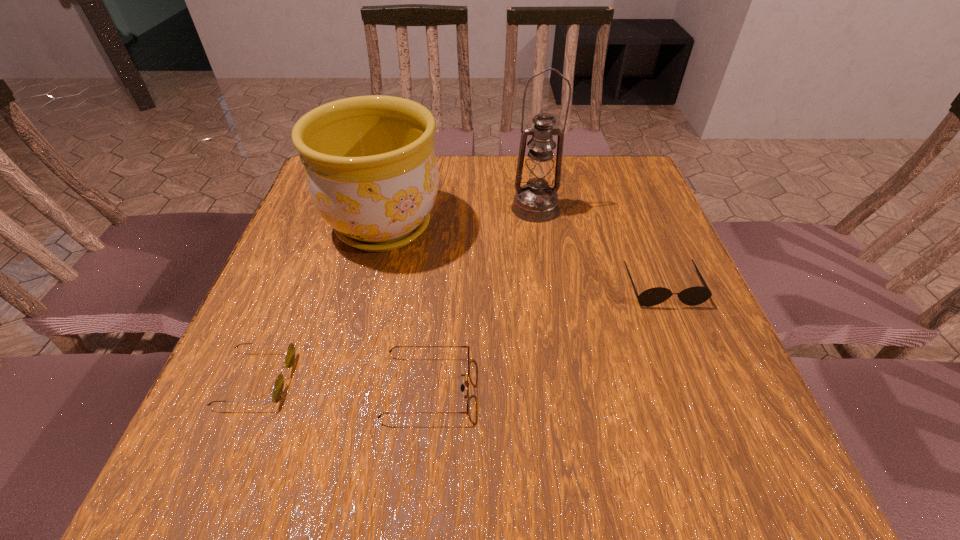
The width and height of the screenshot is (960, 540). In order to click on vacant area that satisfies the following two spatial constraints: 1. on the front-facing side of the tallest sunglasses; 2. on the front-facing side of the second sunglasses from left to right in this screenshot , I will do `click(703, 388)`.